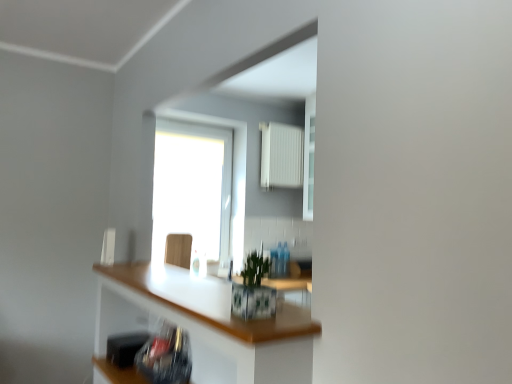
Question: Is white glossy countertop at center in front of or behind wooden swivel chair at center in the image?

Choices:
 (A) behind
 (B) front

Answer: (B)

Question: Is white glossy countertop at center taller or shorter than wooden swivel chair at center?

Choices:
 (A) short
 (B) tall

Answer: (B)

Question: Considering the real-world distances, which object is closest to the white plastic radiator at upper center?

Choices:
 (A) black plastic toaster at lower left
 (B) wooden swivel chair at center
 (C) white glossy countertop at center
 (D) transparent glass window at center

Answer: (D)

Question: Which is farther from the transparent glass window at center?

Choices:
 (A) white glossy countertop at center
 (B) wooden swivel chair at center
 (C) white plastic radiator at upper center
 (D) black plastic toaster at lower left

Answer: (D)